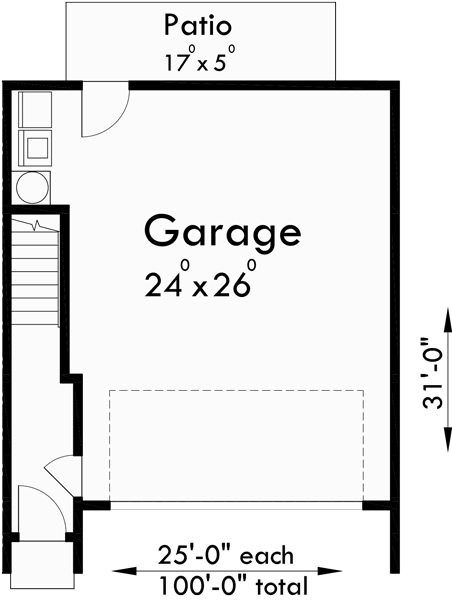
This screenshot has width=452, height=600. I want to click on garage, so click(218, 233).